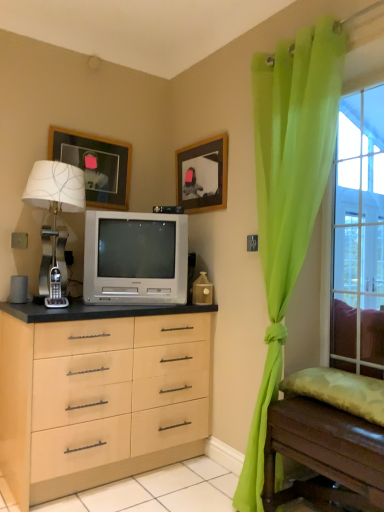
Find the location of a particular element. Image resolution: width=384 pixels, height=512 pixels. green sheer curtain at right is located at coordinates (288, 195).

Locate an element on the screen. The height and width of the screenshot is (512, 384). wooden picture frame at upper center, which is counted as the second picture frame, starting from the left is located at coordinates (202, 175).

Identify the location of silver metallic table lamp at left. (55, 192).

The height and width of the screenshot is (512, 384). What are the coordinates of `wooden picture frame at upper left, the first picture frame when ordered from left to right` in the screenshot? It's located at (95, 165).

Considering the positions of points (82, 176) and (355, 163), is point (82, 176) closer to camera compared to point (355, 163)?

Yes, it is in front of point (355, 163).

From the image's perspective, which one is positioned lower, silver metallic table lamp at left or clear glass window at right?

From the image's view, silver metallic table lamp at left is below.

Would you say silver metallic table lamp at left is inside or outside clear glass window at right?

silver metallic table lamp at left cannot be found inside clear glass window at right.

Considering the relative sizes of silver metallic table lamp at left and clear glass window at right in the image provided, is silver metallic table lamp at left thinner than clear glass window at right?

No, silver metallic table lamp at left is not thinner than clear glass window at right.

Between satin silver television at center and wooden picture frame at upper left, arranged as the 2th picture frame when viewed from the right, which one has smaller width?

Thinner between the two is wooden picture frame at upper left, arranged as the 2th picture frame when viewed from the right.

From the image's perspective, is satin silver television at center located above wooden picture frame at upper left, arranged as the 2th picture frame when viewed from the right?

No.

In the scene shown: Considering the relative positions of satin silver television at center and wooden picture frame at upper left, arranged as the 2th picture frame when viewed from the right, in the image provided, is satin silver television at center to the left of wooden picture frame at upper left, arranged as the 2th picture frame when viewed from the right, from the viewer's perspective?

No, satin silver television at center is not to the left of wooden picture frame at upper left, arranged as the 2th picture frame when viewed from the right.

Is satin silver television at center taller than wooden picture frame at upper left, the first picture frame when ordered from left to right?

Indeed, satin silver television at center has a greater height compared to wooden picture frame at upper left, the first picture frame when ordered from left to right.

Between point (313, 430) and point (344, 246), which one is positioned behind?

Positioned behind is point (344, 246).

Considering the relative positions of wooden table at lower right and clear glass window at right in the image provided, is wooden table at lower right to the left of clear glass window at right from the viewer's perspective?

Yes.

Is clear glass window at right surrounded by wooden table at lower right?

No, clear glass window at right is not inside wooden table at lower right.

I want to click on table below the clear glass window at right (from the image's perspective), so click(324, 455).

Is silver metallic table lamp at left beside green sheer curtain at right?

No, silver metallic table lamp at left is not beside green sheer curtain at right.

Looking at this image, which is closer to the camera, (30, 191) or (270, 248)?

Positioned in front is point (270, 248).

Is silver metallic table lamp at left aimed at green sheer curtain at right?

Yes.

Considering the sizes of silver metallic table lamp at left and green sheer curtain at right in the image, is silver metallic table lamp at left bigger or smaller than green sheer curtain at right?

silver metallic table lamp at left is smaller than green sheer curtain at right.

How different are the orientations of wooden picture frame at upper left, the first picture frame when ordered from left to right, and wooden table at lower right in degrees?

88.5 degrees separate the facing orientations of wooden picture frame at upper left, the first picture frame when ordered from left to right, and wooden table at lower right.

Is wooden picture frame at upper left, arranged as the 2th picture frame when viewed from the right, oriented away from wooden table at lower right?

That's not correct — wooden picture frame at upper left, arranged as the 2th picture frame when viewed from the right, is not looking away from wooden table at lower right.

Is wooden picture frame at upper left, arranged as the 2th picture frame when viewed from the right, touching wooden table at lower right?

wooden picture frame at upper left, arranged as the 2th picture frame when viewed from the right, and wooden table at lower right are not in contact.

Considering the sizes of objects wooden picture frame at upper left, the first picture frame when ordered from left to right, and wooden table at lower right in the image provided, who is taller, wooden picture frame at upper left, the first picture frame when ordered from left to right, or wooden table at lower right?

Standing taller between the two is wooden table at lower right.

How different are the orientations of clear glass window at right and silver metallic table lamp at left in degrees?

They differ by 102 degrees in their facing directions.

Which of these two, clear glass window at right or silver metallic table lamp at left, is wider?

With larger width is silver metallic table lamp at left.

From the picture: Is clear glass window at right aimed at silver metallic table lamp at left?

No, clear glass window at right is not turned towards silver metallic table lamp at left.

From a real-world perspective, is clear glass window at right located higher than silver metallic table lamp at left?

Yes, from a real-world perspective, clear glass window at right is over silver metallic table lamp at left

Visually, is silver metallic table lamp at left positioned to the left or to the right of satin silver television at center?

From the image, it's evident that silver metallic table lamp at left is to the left of satin silver television at center.

Considering the relative sizes of silver metallic table lamp at left and satin silver television at center in the image provided, is silver metallic table lamp at left smaller than satin silver television at center?

Indeed, silver metallic table lamp at left has a smaller size compared to satin silver television at center.

Is silver metallic table lamp at left looking in the opposite direction of satin silver television at center?

No, satin silver television at center is not at the back of silver metallic table lamp at left.

Between silver metallic table lamp at left and satin silver television at center, which one has smaller width?

satin silver television at center.

Locate an element on the screen. The height and width of the screenshot is (512, 384). window that appears above the silver metallic table lamp at left (from the image's perspective) is located at coordinates (359, 236).

This screenshot has width=384, height=512. I want to click on the 2nd picture frame behind when counting from the satin silver television at center, so click(x=95, y=165).

From the image, which object appears to be nearer to silver metallic table lamp at left, wooden picture frame at upper left, the first picture frame when ordered from left to right, or clear glass window at right?

The object closer to silver metallic table lamp at left is wooden picture frame at upper left, the first picture frame when ordered from left to right.

Based on their spatial positions, is silver metallic table lamp at left or wooden picture frame at upper left, arranged as the 2th picture frame when viewed from the right, closer to green sheer curtain at right?

silver metallic table lamp at left is closer to green sheer curtain at right.

Based on their spatial positions, is green sheer curtain at right or satin silver television at center closer to wooden table at lower right?

Based on the image, green sheer curtain at right appears to be nearer to wooden table at lower right.

From the image, which object appears to be farther from wooden table at lower right, wooden picture frame at upper left, the first picture frame when ordered from left to right, or silver metallic table lamp at left?

wooden picture frame at upper left, the first picture frame when ordered from left to right.

Looking at the image, which one is located further to wooden picture frame at upper left, arranged as the 2th picture frame when viewed from the right, satin silver television at center or silver metallic table lamp at left?

Among the two, satin silver television at center is located further to wooden picture frame at upper left, arranged as the 2th picture frame when viewed from the right.

When comparing their distances from wooden picture frame at upper left, arranged as the 2th picture frame when viewed from the right, does green sheer curtain at right or wooden picture frame at upper center, which is counted as the second picture frame, starting from the left, seem further?

Based on the image, green sheer curtain at right appears to be further to wooden picture frame at upper left, arranged as the 2th picture frame when viewed from the right.

Based on their spatial positions, is silver metallic table lamp at left or satin silver television at center closer to wooden picture frame at upper left, arranged as the 2th picture frame when viewed from the right?

silver metallic table lamp at left is positioned closer to the anchor wooden picture frame at upper left, arranged as the 2th picture frame when viewed from the right.

Looking at the image, which one is located further to satin silver television at center, wooden picture frame at upper center, which is counted as the second picture frame, starting from the left, or silver metallic table lamp at left?

wooden picture frame at upper center, which is counted as the second picture frame, starting from the left, is further to satin silver television at center.

I want to click on television between wooden picture frame at upper left, the first picture frame when ordered from left to right, and wooden picture frame at upper center, which is counted as the second picture frame, starting from the left, so click(x=135, y=258).

At what (x,y) coordinates should I click in order to perform the action: click on table between silver metallic table lamp at left and clear glass window at right in the horizontal direction. Please return your answer as a coordinate pair (x, y). The image size is (384, 512). Looking at the image, I should click on (324, 455).

You are a GUI agent. You are given a task and a screenshot of the screen. Output one action in this format:
    pyautogui.click(x=<x>, y=<y>)
    Task: Click on the table between satin silver television at center and clear glass window at right in the horizontal direction
    
    Given the screenshot: What is the action you would take?
    pyautogui.click(x=324, y=455)

Image resolution: width=384 pixels, height=512 pixels. In order to click on curtain situated between silver metallic table lamp at left and clear glass window at right from left to right in this screenshot , I will do `click(288, 195)`.